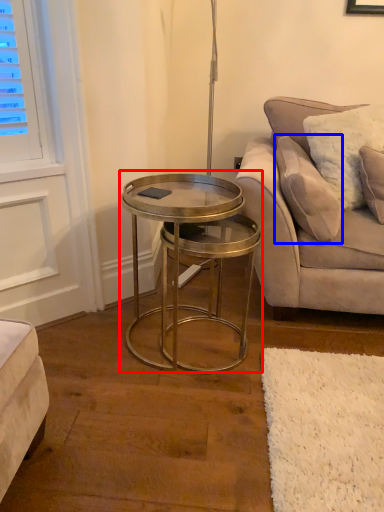
Question: Which of the following is the closest to the observer, coffee table (highlighted by a red box) or pillow (highlighted by a blue box)?

Choices:
 (A) coffee table
 (B) pillow

Answer: (A)